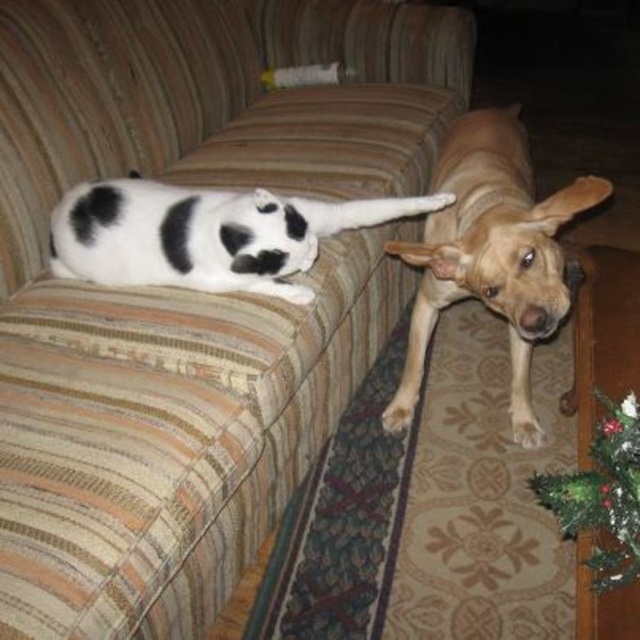
Question: Which point is closer to the camera?

Choices:
 (A) (541, 444)
 (B) (616, 426)

Answer: (B)

Question: Does golden tan fur dog at right appear on the right side of light brown fur at lower right?

Choices:
 (A) no
 (B) yes

Answer: (B)

Question: Which object is farther from the camera taking this photo?

Choices:
 (A) green textured christmas tree at lower right
 (B) white-spotted fur cat at upper left
 (C) striped fabric couch at upper left

Answer: (B)

Question: Estimate the real-world distances between objects in this image. Which object is farther from the golden tan fur dog at right?

Choices:
 (A) light brown fur at lower right
 (B) green textured christmas tree at lower right
 (C) striped fabric couch at upper left

Answer: (A)

Question: Is striped fabric couch at upper left bigger than light brown fur at lower right?

Choices:
 (A) no
 (B) yes

Answer: (B)

Question: Can you confirm if striped fabric couch at upper left is positioned to the right of light brown fur at lower right?

Choices:
 (A) no
 (B) yes

Answer: (A)